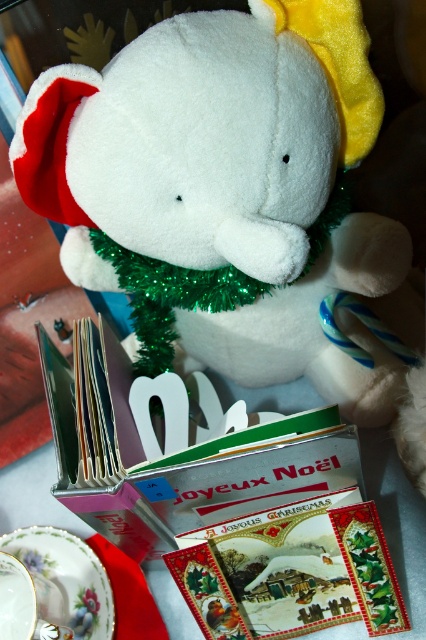
Question: Which of the following is the farthest from the observer?

Choices:
 (A) white plush toy at center
 (B) porcelain floral saucer at lower left

Answer: (B)

Question: In this image, where is white plush toy at center located relative to porcelain floral saucer at lower left?

Choices:
 (A) above
 (B) below

Answer: (A)

Question: Does white plush toy at center lie in front of porcelain floral saucer at lower left?

Choices:
 (A) no
 (B) yes

Answer: (B)

Question: Among these objects, which one is nearest to the camera?

Choices:
 (A) white plush toy at center
 (B) porcelain floral saucer at lower left

Answer: (A)

Question: Can you confirm if white plush toy at center is smaller than porcelain floral saucer at lower left?

Choices:
 (A) no
 (B) yes

Answer: (A)

Question: Which point appears farthest from the camera in this image?

Choices:
 (A) (68, 577)
 (B) (236, 256)

Answer: (A)